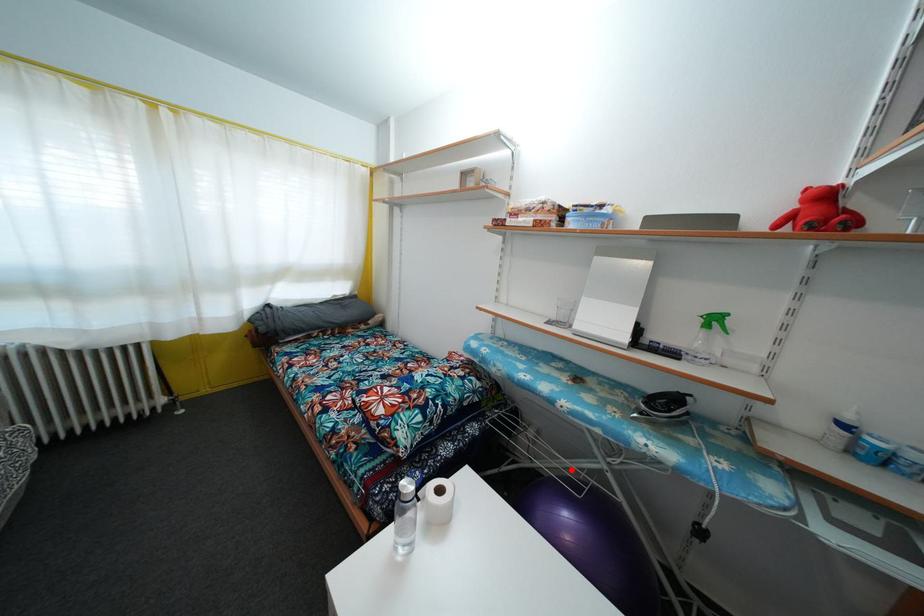
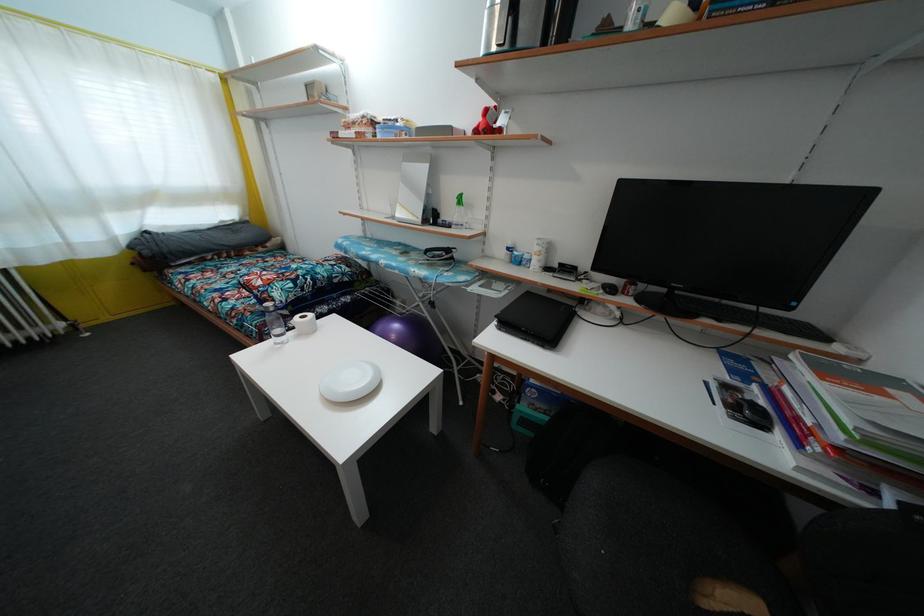
Question: I am providing you with two images of the same scene from different viewpoints. Given a red point in image1, look at the same physical point in image2. Is it:

Choices:
 (A) Closer to the viewpoint
 (B) Farther from the viewpoint

Answer: (B)